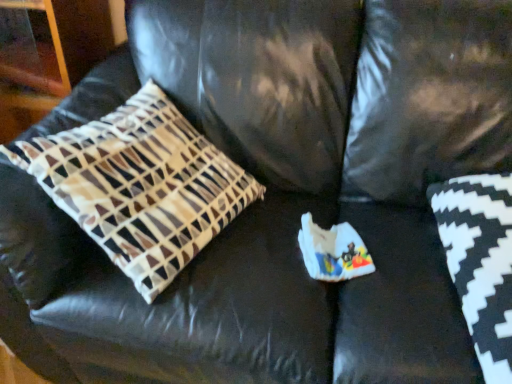
You are a GUI agent. You are given a task and a screenshot of the screen. Output one action in this format:
    pyautogui.click(x=<x>, y=<y>)
    Task: Click on the black and white zigzag pillow at lower right, which is the 2th pillow in left-to-right order
    The width and height of the screenshot is (512, 384).
    Given the screenshot: What is the action you would take?
    pyautogui.click(x=480, y=262)

What do you see at coordinates (480, 262) in the screenshot? I see `black and white zigzag pillow at lower right, which is the 2th pillow in left-to-right order` at bounding box center [480, 262].

The height and width of the screenshot is (384, 512). Describe the element at coordinates (140, 186) in the screenshot. I see `patterned fabric pillow at left, which appears as the 1th pillow when viewed from the left` at that location.

I want to click on patterned fabric pillow at left, which appears as the 1th pillow when viewed from the left, so click(140, 186).

Measure the distance between patterned fabric pillow at left, which appears as the 1th pillow when viewed from the left, and camera.

patterned fabric pillow at left, which appears as the 1th pillow when viewed from the left, is 33.83 inches away from camera.

This screenshot has height=384, width=512. Identify the location of black and white zigzag pillow at lower right, which is the 2th pillow in left-to-right order. (480, 262).

Does patterned fabric pillow at left, marked as the second pillow in a right-to-left arrangement, appear on the right side of black and white zigzag pillow at lower right, which is the 2th pillow in left-to-right order?

In fact, patterned fabric pillow at left, marked as the second pillow in a right-to-left arrangement, is to the left of black and white zigzag pillow at lower right, which is the 2th pillow in left-to-right order.

Which object is further away from the camera, patterned fabric pillow at left, which appears as the 1th pillow when viewed from the left, or black and white zigzag pillow at lower right, which is the 2th pillow in left-to-right order?

Positioned behind is black and white zigzag pillow at lower right, which is the 2th pillow in left-to-right order.

Does point (153, 223) appear closer or farther from the camera than point (483, 209)?

Clearly, point (153, 223) is closer to the camera than point (483, 209).

From the image's perspective, is patterned fabric pillow at left, marked as the second pillow in a right-to-left arrangement, above or below black and white zigzag pillow at lower right, which ranks as the 1th pillow in right-to-left order?

patterned fabric pillow at left, marked as the second pillow in a right-to-left arrangement, is situated higher than black and white zigzag pillow at lower right, which ranks as the 1th pillow in right-to-left order, in the image.

From a real-world perspective, which object stands above the other?

patterned fabric pillow at left, which appears as the 1th pillow when viewed from the left, is physically above.

Considering the sizes of patterned fabric pillow at left, which appears as the 1th pillow when viewed from the left, and black and white zigzag pillow at lower right, which ranks as the 1th pillow in right-to-left order, in the image, is patterned fabric pillow at left, which appears as the 1th pillow when viewed from the left, wider or thinner than black and white zigzag pillow at lower right, which ranks as the 1th pillow in right-to-left order,?

Clearly, patterned fabric pillow at left, which appears as the 1th pillow when viewed from the left, has less width compared to black and white zigzag pillow at lower right, which ranks as the 1th pillow in right-to-left order.

Is patterned fabric pillow at left, marked as the second pillow in a right-to-left arrangement, taller than black and white zigzag pillow at lower right, which is the 2th pillow in left-to-right order?

Yes.

From the picture: Considering the relative sizes of patterned fabric pillow at left, which appears as the 1th pillow when viewed from the left, and black and white zigzag pillow at lower right, which is the 2th pillow in left-to-right order, in the image provided, is patterned fabric pillow at left, which appears as the 1th pillow when viewed from the left, bigger than black and white zigzag pillow at lower right, which is the 2th pillow in left-to-right order,?

Indeed, patterned fabric pillow at left, which appears as the 1th pillow when viewed from the left, has a larger size compared to black and white zigzag pillow at lower right, which is the 2th pillow in left-to-right order.

Is patterned fabric pillow at left, which appears as the 1th pillow when viewed from the left, inside the boundaries of black and white zigzag pillow at lower right, which is the 2th pillow in left-to-right order, or outside?

patterned fabric pillow at left, which appears as the 1th pillow when viewed from the left, is not inside black and white zigzag pillow at lower right, which is the 2th pillow in left-to-right order, it's outside.

Is there a large distance between patterned fabric pillow at left, marked as the second pillow in a right-to-left arrangement, and black and white zigzag pillow at lower right, which is the 2th pillow in left-to-right order?

That's not correct — patterned fabric pillow at left, marked as the second pillow in a right-to-left arrangement, is a little close to black and white zigzag pillow at lower right, which is the 2th pillow in left-to-right order.

From the picture: Could you tell me if patterned fabric pillow at left, which appears as the 1th pillow when viewed from the left, is turned towards black and white zigzag pillow at lower right, which ranks as the 1th pillow in right-to-left order?

No, patterned fabric pillow at left, which appears as the 1th pillow when viewed from the left, is not turned towards black and white zigzag pillow at lower right, which ranks as the 1th pillow in right-to-left order.

Identify the location of pillow in front of the black and white zigzag pillow at lower right, which ranks as the 1th pillow in right-to-left order. This screenshot has width=512, height=384. (140, 186).

Which is more to the right, black and white zigzag pillow at lower right, which ranks as the 1th pillow in right-to-left order, or patterned fabric pillow at left, marked as the second pillow in a right-to-left arrangement?

black and white zigzag pillow at lower right, which ranks as the 1th pillow in right-to-left order, is more to the right.

Between black and white zigzag pillow at lower right, which is the 2th pillow in left-to-right order, and patterned fabric pillow at left, marked as the second pillow in a right-to-left arrangement, which one is positioned in front?

Positioned in front is patterned fabric pillow at left, marked as the second pillow in a right-to-left arrangement.

Considering the points (506, 293) and (160, 185), which point is in front, point (506, 293) or point (160, 185)?

The point (506, 293) is closer to the camera.

From the image's perspective, is black and white zigzag pillow at lower right, which ranks as the 1th pillow in right-to-left order, located above patterned fabric pillow at left, which appears as the 1th pillow when viewed from the left?

No, from the image's perspective, black and white zigzag pillow at lower right, which ranks as the 1th pillow in right-to-left order, is not above patterned fabric pillow at left, which appears as the 1th pillow when viewed from the left.

Looking at this image, from a real-world perspective, between black and white zigzag pillow at lower right, which is the 2th pillow in left-to-right order, and patterned fabric pillow at left, which appears as the 1th pillow when viewed from the left, who is vertically higher?

patterned fabric pillow at left, which appears as the 1th pillow when viewed from the left, is physically above.

Can you confirm if black and white zigzag pillow at lower right, which is the 2th pillow in left-to-right order, is thinner than patterned fabric pillow at left, marked as the second pillow in a right-to-left arrangement?

In fact, black and white zigzag pillow at lower right, which is the 2th pillow in left-to-right order, might be wider than patterned fabric pillow at left, marked as the second pillow in a right-to-left arrangement.

Can you confirm if black and white zigzag pillow at lower right, which is the 2th pillow in left-to-right order, is shorter than patterned fabric pillow at left, marked as the second pillow in a right-to-left arrangement?

Correct, black and white zigzag pillow at lower right, which is the 2th pillow in left-to-right order, is not as tall as patterned fabric pillow at left, marked as the second pillow in a right-to-left arrangement.

Who is smaller, black and white zigzag pillow at lower right, which ranks as the 1th pillow in right-to-left order, or patterned fabric pillow at left, which appears as the 1th pillow when viewed from the left?

black and white zigzag pillow at lower right, which ranks as the 1th pillow in right-to-left order.

Would you say black and white zigzag pillow at lower right, which ranks as the 1th pillow in right-to-left order, is outside patterned fabric pillow at left, which appears as the 1th pillow when viewed from the left?

Yes, black and white zigzag pillow at lower right, which ranks as the 1th pillow in right-to-left order, is not within patterned fabric pillow at left, which appears as the 1th pillow when viewed from the left.

Looking at this image, are black and white zigzag pillow at lower right, which ranks as the 1th pillow in right-to-left order, and patterned fabric pillow at left, marked as the second pillow in a right-to-left arrangement, beside each other?

black and white zigzag pillow at lower right, which ranks as the 1th pillow in right-to-left order, is not next to patterned fabric pillow at left, marked as the second pillow in a right-to-left arrangement, and they're not touching.

Is black and white zigzag pillow at lower right, which ranks as the 1th pillow in right-to-left order, aimed at patterned fabric pillow at left, which appears as the 1th pillow when viewed from the left?

No, black and white zigzag pillow at lower right, which ranks as the 1th pillow in right-to-left order, does not turn towards patterned fabric pillow at left, which appears as the 1th pillow when viewed from the left.

Looking at this image, measure the distance between black and white zigzag pillow at lower right, which ranks as the 1th pillow in right-to-left order, and patterned fabric pillow at left, marked as the second pillow in a right-to-left arrangement.

25.26 inches.

This screenshot has width=512, height=384. Find the location of `pillow behind the patterned fabric pillow at left, marked as the second pillow in a right-to-left arrangement`. pillow behind the patterned fabric pillow at left, marked as the second pillow in a right-to-left arrangement is located at coordinates (480, 262).

Where is `pillow in front of the black and white zigzag pillow at lower right, which ranks as the 1th pillow in right-to-left order`? The height and width of the screenshot is (384, 512). pillow in front of the black and white zigzag pillow at lower right, which ranks as the 1th pillow in right-to-left order is located at coordinates (140, 186).

What are the coordinates of `pillow that appears above the black and white zigzag pillow at lower right, which ranks as the 1th pillow in right-to-left order (from a real-world perspective)` in the screenshot? It's located at (140, 186).